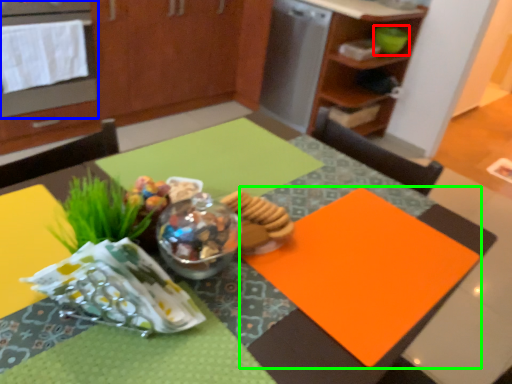
Question: Considering the real-world distances, which object is farthest from teal (highlighted by a red box)? oven (highlighted by a blue box) or place mat (highlighted by a green box)?

Choices:
 (A) oven
 (B) place mat

Answer: (B)